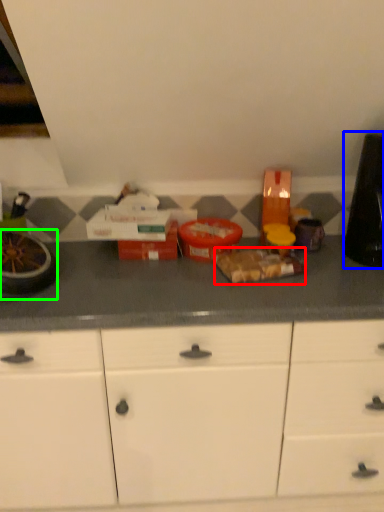
Question: Estimate the real-world distances between objects in this image. Which object is farther from food (highlighted by a red box), appliance (highlighted by a blue box) or appliance (highlighted by a green box)?

Choices:
 (A) appliance
 (B) appliance

Answer: (B)